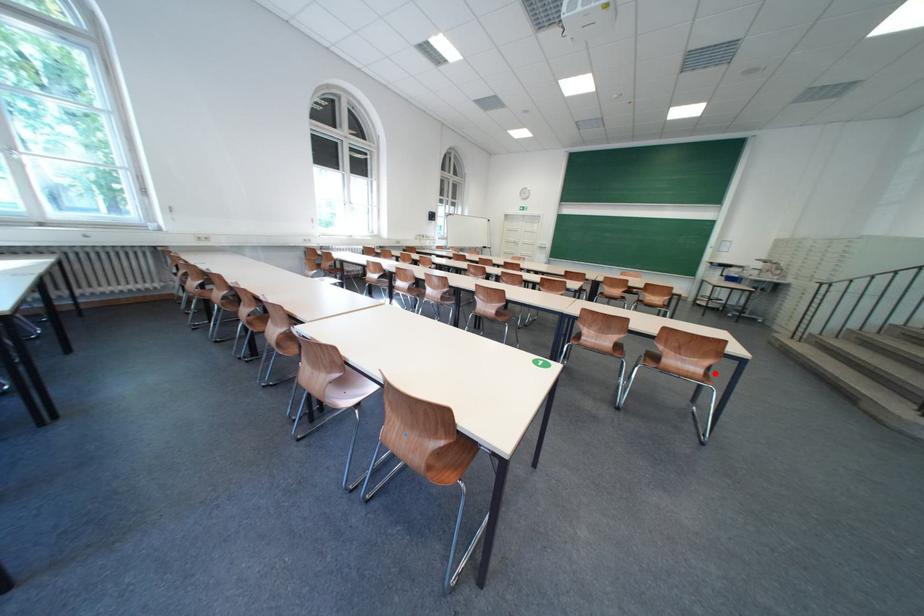
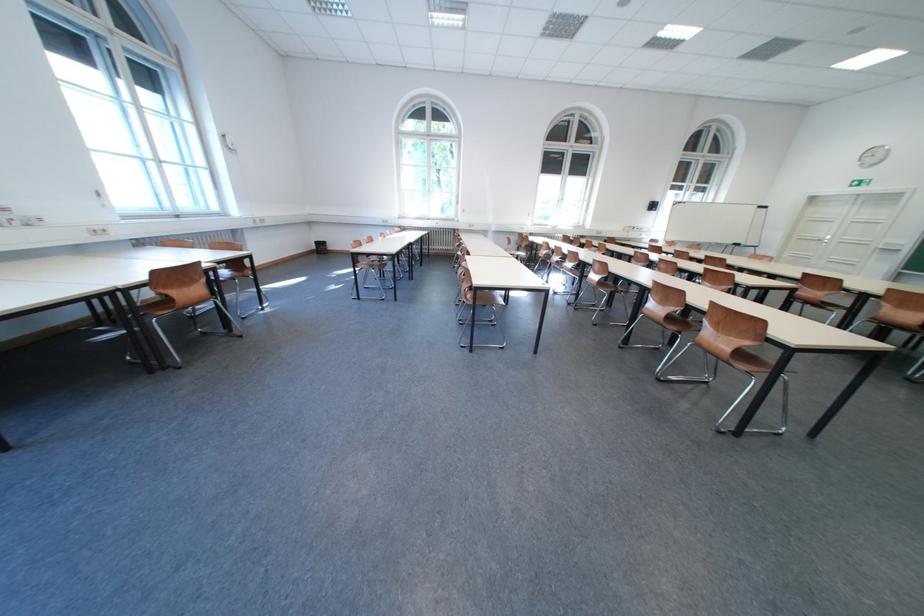
In the second image, find the point that corresponds to the highlighted location in the first image.

(744, 352)